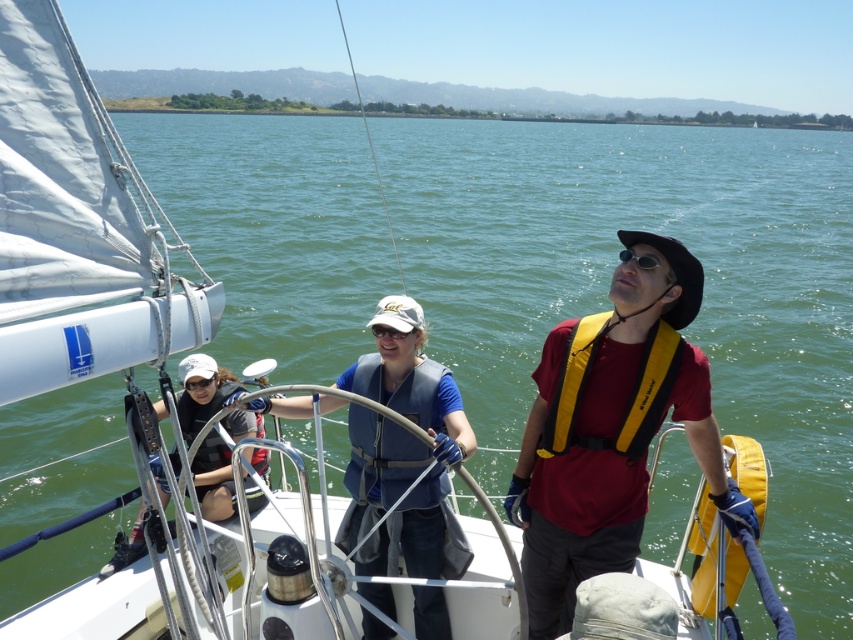
You are on a sailboat and want to determine which of the two points, point (633, 253) or point (395, 339), is closer to you. Based on the scene described, which point is nearer?

Point (633, 253) is closer to the camera than point (395, 339), so it is the nearer point.

You are on a sailboat and want to retrieve an object located at point (540, 472). The boat has a 12 foot long telescoping pole. Can you reach the object with the pole?

The point (540, 472) is 13.13 feet away from the camera, so the telescoping pole which is only 12 feet long is insufficient to reach it.